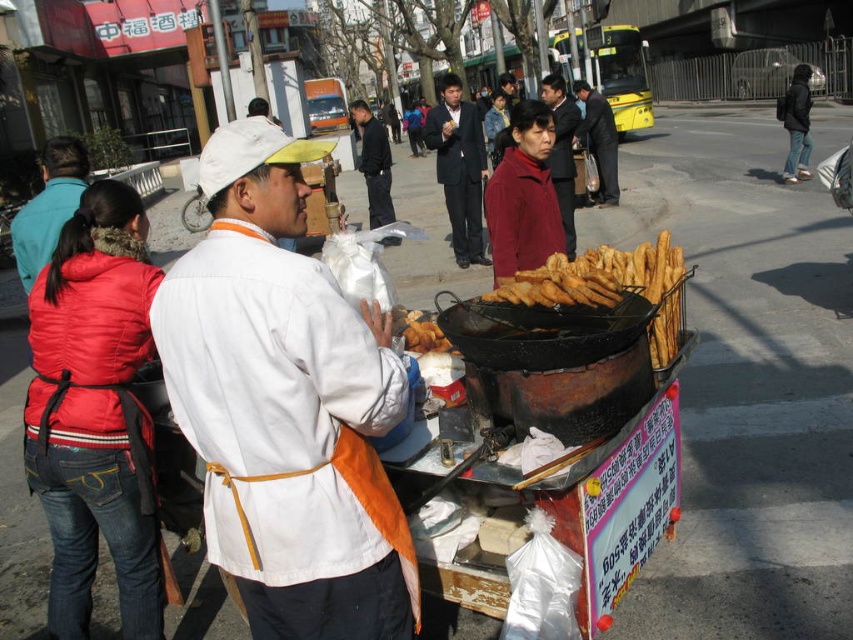
Between point (350, 422) and point (642, 280), which one is positioned in front?

Positioned in front is point (350, 422).

Who is positioned more to the right, white fabric jacket at center or golden crispy fried dough at center?

From the viewer's perspective, golden crispy fried dough at center appears more on the right side.

The width and height of the screenshot is (853, 640). I want to click on white fabric jacket at center, so click(x=285, y=404).

Which is in front, point (383, 499) or point (454, 134)?

Point (383, 499) is in front.

Between white fabric jacket at center and dark blue suit at center, which one has less height?

white fabric jacket at center is shorter.

Does point (225, 422) lie behind point (466, 253)?

No, it is not.

Find the location of a particular element. This screenshot has height=640, width=853. white fabric jacket at center is located at coordinates (285, 404).

Is dark blue suit at center taller than maroon fabric jacket at center?

Yes, dark blue suit at center is taller than maroon fabric jacket at center.

Does dark blue suit at center have a lesser height compared to maroon fabric jacket at center?

Incorrect, dark blue suit at center's height does not fall short of maroon fabric jacket at center's.

Does point (474, 216) come behind point (554, 112)?

No.

I want to click on dark blue suit at center, so click(459, 168).